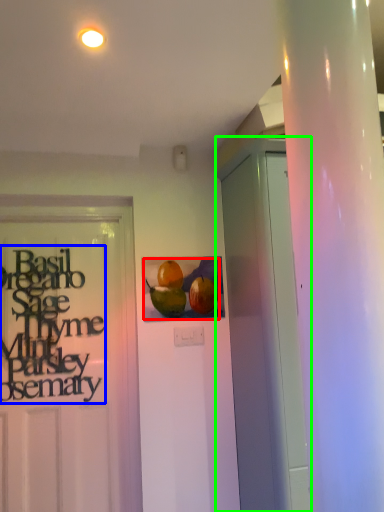
Question: Which object is the farthest from fruit (highlighted by a red box)? Choose among these: lettering (highlighted by a blue box) or garage door (highlighted by a green box).

Choices:
 (A) lettering
 (B) garage door

Answer: (A)